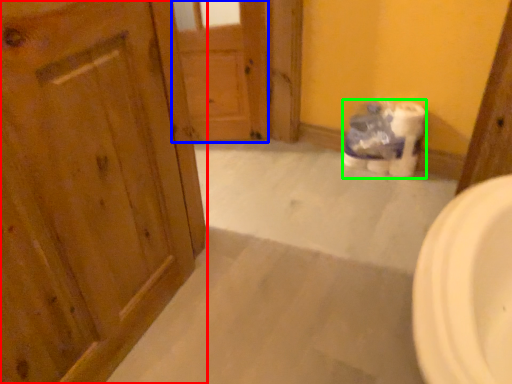
Question: Which object is the closest to the door (highlighted by a red box)? Choose among these: door (highlighted by a blue box) or toilet paper (highlighted by a green box).

Choices:
 (A) door
 (B) toilet paper

Answer: (A)